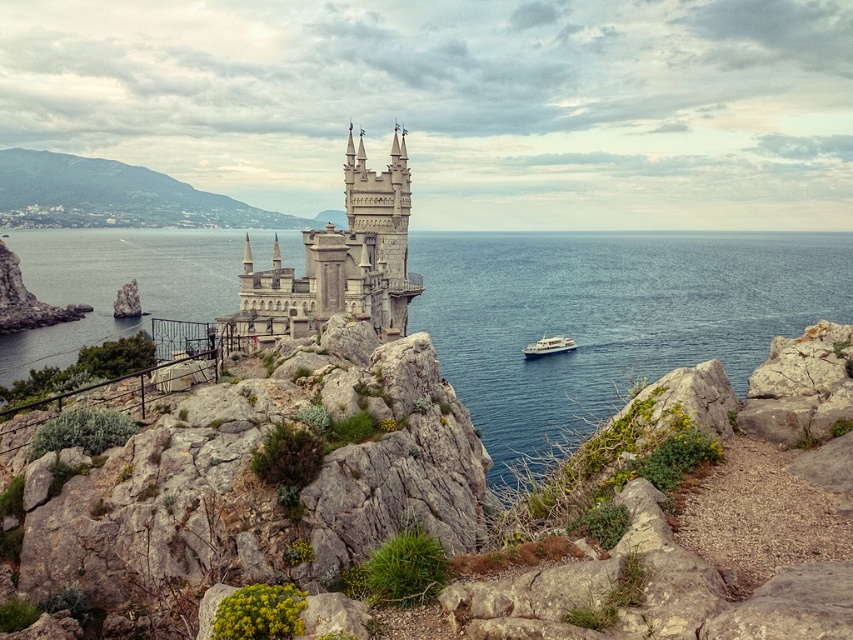
Does point (704, 358) lie behind point (560, 342)?

Yes, it is.

You are a GUI agent. You are given a task and a screenshot of the screen. Output one action in this format:
    pyautogui.click(x=<x>, y=<y>)
    Task: Click on the blue water at center
    
    Given the screenshot: What is the action you would take?
    pyautogui.click(x=608, y=316)

Can you confirm if blue water at center is bigger than green grassy hillside at upper left?

Indeed, blue water at center has a larger size compared to green grassy hillside at upper left.

How far apart are blue water at center and green grassy hillside at upper left?

blue water at center is 105.20 meters away from green grassy hillside at upper left.

Is point (555, 440) farther from viewer compared to point (259, 216)?

That is False.

Identify the location of blue water at center. (608, 316).

Can you confirm if blue water at center is positioned to the right of stone castle at center?

In fact, blue water at center is to the left of stone castle at center.

At what (x,y) coordinates should I click in order to perform the action: click on blue water at center. Please return your answer as a coordinate pair (x, y). Image resolution: width=853 pixels, height=640 pixels. Looking at the image, I should click on (608, 316).